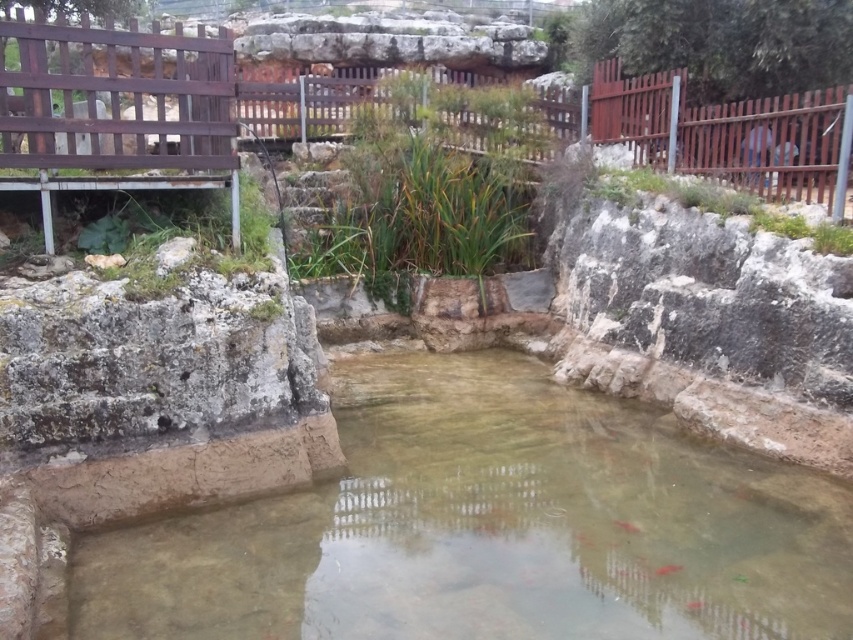
You are a photographer trying to capture the translucent pink fish at center in the smooth stone pond at center. Which object should you focus on first to ensure the fish is in the frame?

The smooth stone pond at center is positioned on the left side of the translucent pink fish at center, so you should focus on the smooth stone pond at center first to ensure the fish is in the frame.

You are an aquatic biologist observing the pond. You notice two fish swimming at the center of the pond. Which fish has a smaller body width between the translucent pink fish at center and the shiny orange fish at center?

The translucent pink fish at center has a smaller body width than the shiny orange fish at center.

You are standing at the wooden bridge and want to walk towards the point that is closer to you. Which point should you head towards, point (578, 509) or point (664, 573)?

You should head towards point (578, 509) because it is closer to you compared to point (664, 573).